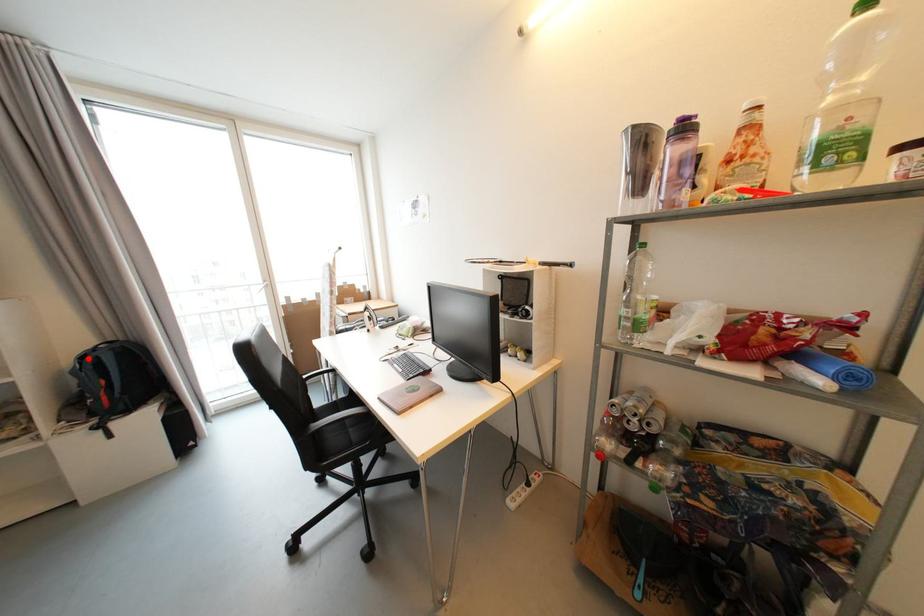
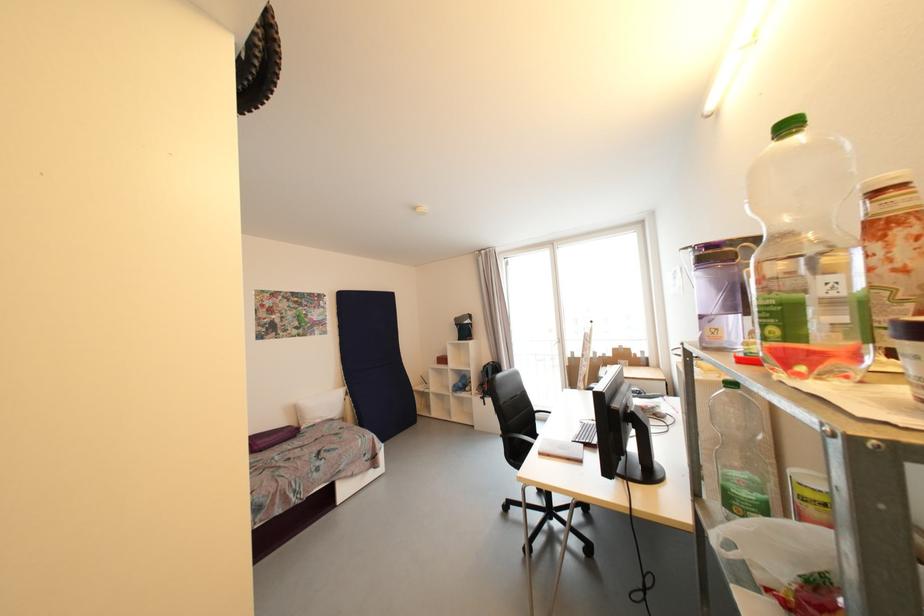
In the second image, find the point that corresponds to the highlighted location in the first image.

(490, 368)